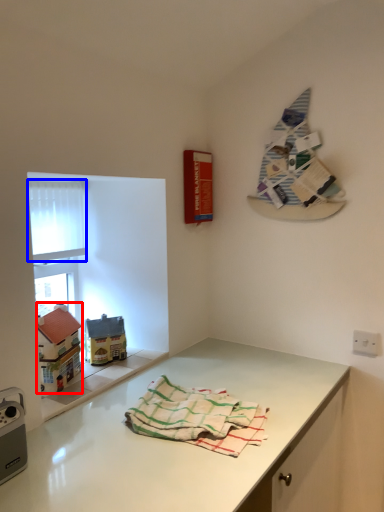
Question: Which object appears closest to the camera in this image, toy (highlighted by a red box) or window screen (highlighted by a blue box)?

Choices:
 (A) toy
 (B) window screen

Answer: (A)